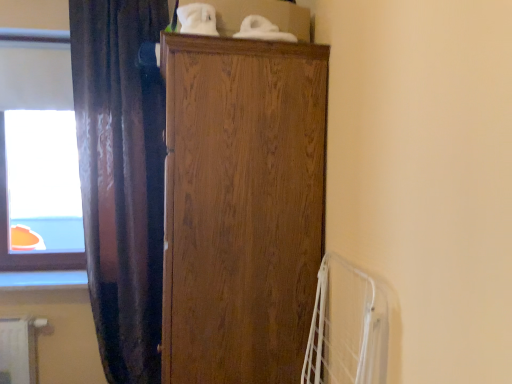
Locate an element on the screen. vacant area on top of transparent glass window at upper left (from a real-world perspective) is located at coordinates (35, 33).